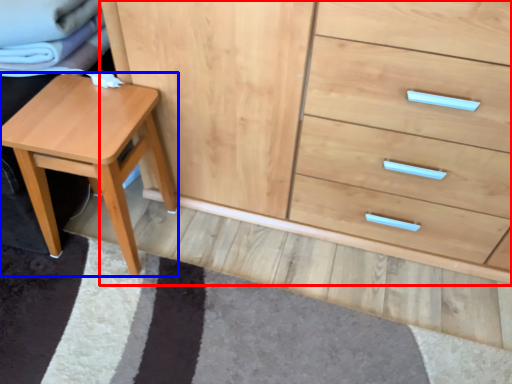
Question: Which object is closer to the camera taking this photo, chest of drawers (highlighted by a red box) or stool (highlighted by a blue box)?

Choices:
 (A) chest of drawers
 (B) stool

Answer: (A)